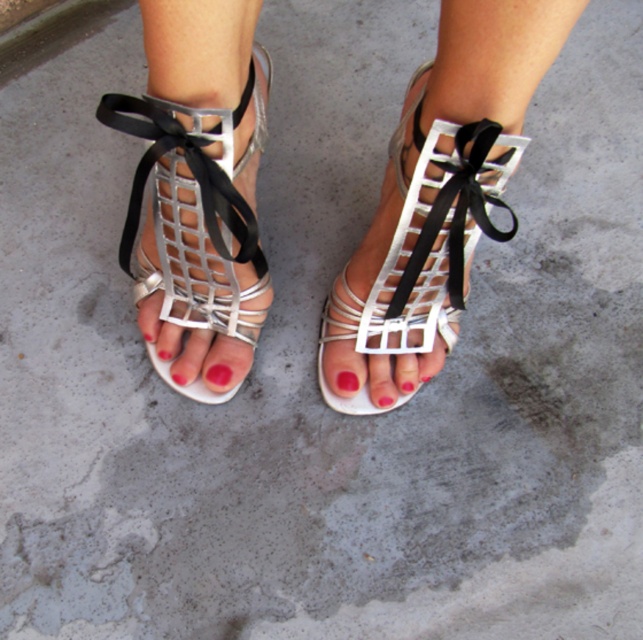
You are a makeup artist looking for the pink matte nail polish at center. Based on the scene description, where should you look to find it?

The pink matte nail polish at center is located at point [217,378].